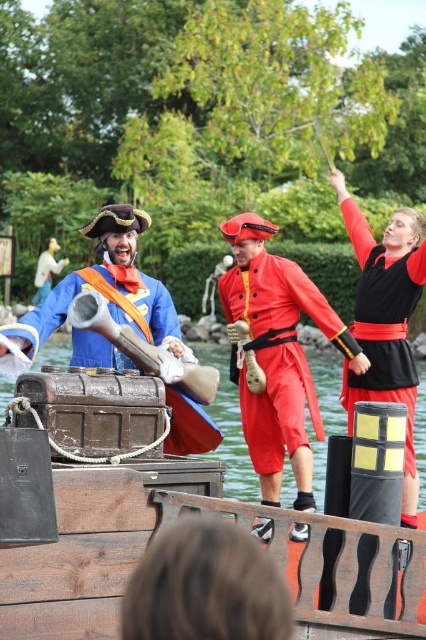
Question: Which object is positioned farthest from the brown leather hair at lower center?

Choices:
 (A) matte blue fabric at center
 (B) shiny red uniform at center
 (C) wooden treasure chest at center
 (D) wooden planks boat at center

Answer: (A)

Question: Is wooden treasure chest at center thinner than wooden cannon at center?

Choices:
 (A) no
 (B) yes

Answer: (A)

Question: Among these objects, which one is nearest to the camera?

Choices:
 (A) wooden cannon at center
 (B) wooden treasure chest at center

Answer: (B)

Question: Can you confirm if shiny red uniform at center is smaller than wooden treasure chest at center?

Choices:
 (A) no
 (B) yes

Answer: (A)

Question: Observing the image, what is the correct spatial positioning of brown leather hair at lower center in reference to black matte vest at center?

Choices:
 (A) right
 (B) left

Answer: (B)

Question: Which point is closer to the camera?

Choices:
 (A) (339, 330)
 (B) (180, 380)
 (C) (48, 273)

Answer: (B)